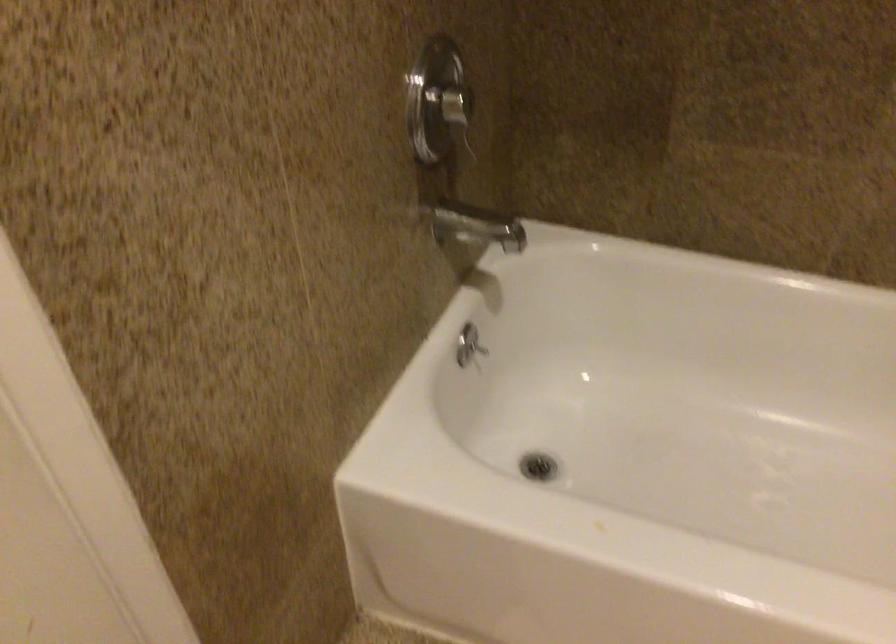
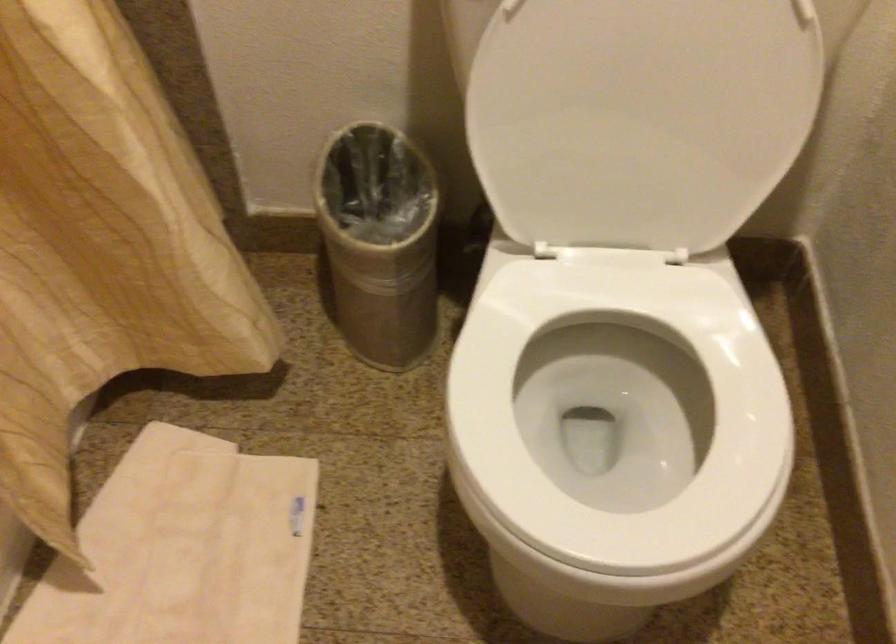
The images are taken continuously from a first-person perspective. In which direction is your viewpoint rotating?

The rotation direction of the camera is right-down.